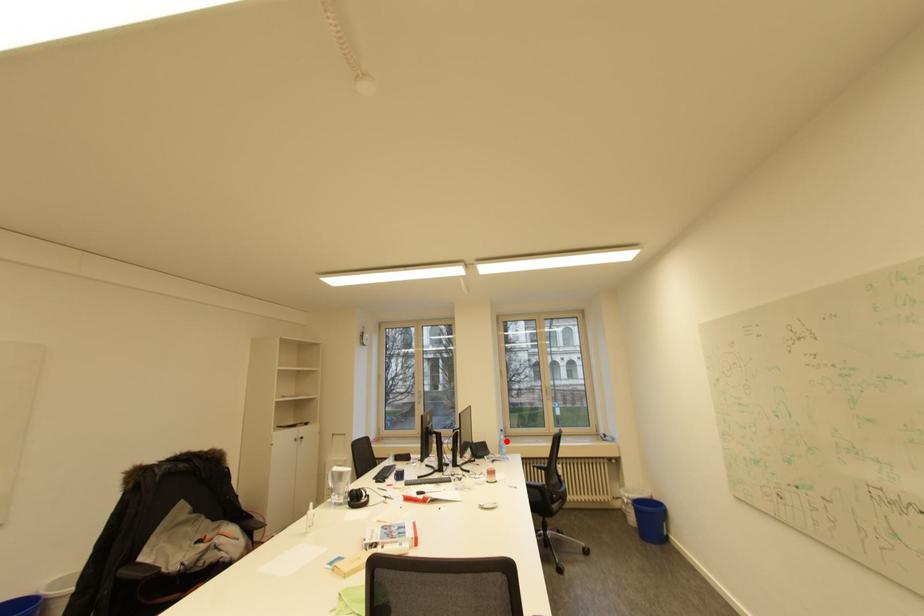
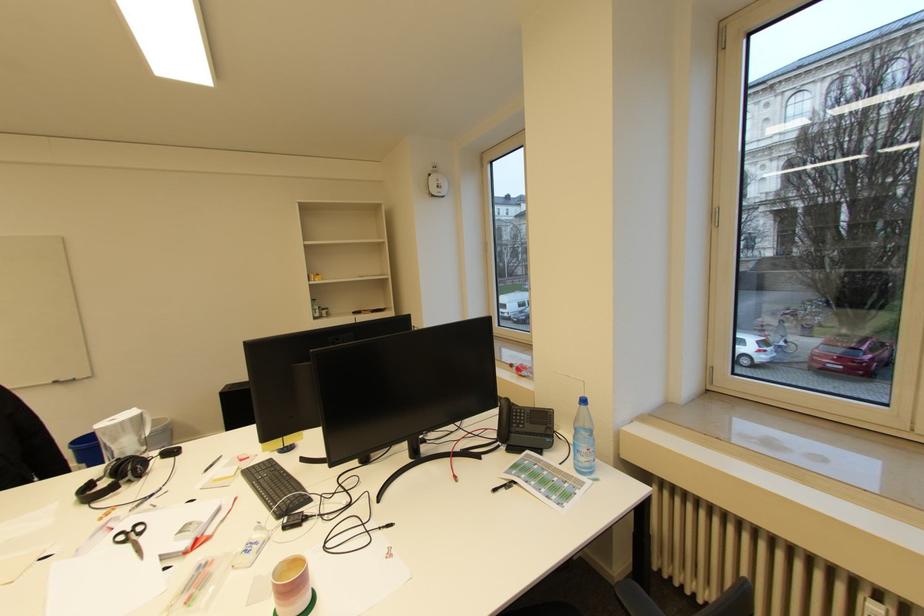
The point at the highlighted location is marked in the first image. Where is the corresponding point in the second image?

(581, 429)